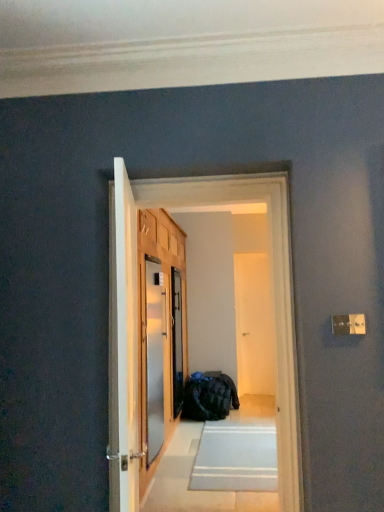
Question: In which direction should I rotate to look at satin silver screen door at center, which is the 1th screen door from front to back?

Choices:
 (A) left
 (B) right

Answer: (A)

Question: From a real-world perspective, is satin silver screen door at center, which is the 1th screen door from front to back, positioned over metallic refrigerator at center based on gravity?

Choices:
 (A) yes
 (B) no

Answer: (B)

Question: Is satin silver screen door at center, which appears as the 1th screen door when viewed from the left, oriented away from metallic refrigerator at center?

Choices:
 (A) no
 (B) yes

Answer: (A)

Question: Can you confirm if satin silver screen door at center, which appears as the 1th screen door when viewed from the left, is taller than metallic refrigerator at center?

Choices:
 (A) yes
 (B) no

Answer: (B)

Question: Does satin silver screen door at center, which is the 1th screen door from front to back, come in front of metallic refrigerator at center?

Choices:
 (A) no
 (B) yes

Answer: (A)

Question: Does satin silver screen door at center, which is the 1th screen door from front to back, have a greater width compared to metallic refrigerator at center?

Choices:
 (A) no
 (B) yes

Answer: (A)

Question: From the image's perspective, would you say satin silver screen door at center, which appears as the 1th screen door when viewed from the left, is positioned over metallic refrigerator at center?

Choices:
 (A) yes
 (B) no

Answer: (B)

Question: Can you confirm if satin silver screen door at center, the third screen door positioned from the back, is thinner than white glossy door at center, acting as the 1th screen door starting from the right?

Choices:
 (A) yes
 (B) no

Answer: (B)

Question: Is the position of satin silver screen door at center, the third screen door positioned from the back, less distant than that of white glossy door at center, which ranks as the 3th screen door in left-to-right order?

Choices:
 (A) yes
 (B) no

Answer: (A)

Question: Is satin silver screen door at center, the third screen door positioned from the back, oriented away from white glossy door at center, the first screen door in the back-to-front sequence?

Choices:
 (A) yes
 (B) no

Answer: (B)

Question: Are satin silver screen door at center, which is the 1th screen door from front to back, and white glossy door at center, positioned as the 3th screen door in front-to-back order, making contact?

Choices:
 (A) yes
 (B) no

Answer: (B)

Question: Is satin silver screen door at center, the 3th screen door positioned from the right, to the right of white glossy door at center, which ranks as the 3th screen door in left-to-right order, from the viewer's perspective?

Choices:
 (A) yes
 (B) no

Answer: (B)

Question: From the image's perspective, is satin silver screen door at center, the third screen door positioned from the back, under white glossy door at center, which ranks as the 3th screen door in left-to-right order?

Choices:
 (A) yes
 (B) no

Answer: (B)

Question: Considering the relative positions of metallic refrigerator at center and satin silver screen door at center, the third screen door positioned from the back, in the image provided, is metallic refrigerator at center to the left of satin silver screen door at center, the third screen door positioned from the back, from the viewer's perspective?

Choices:
 (A) no
 (B) yes

Answer: (A)